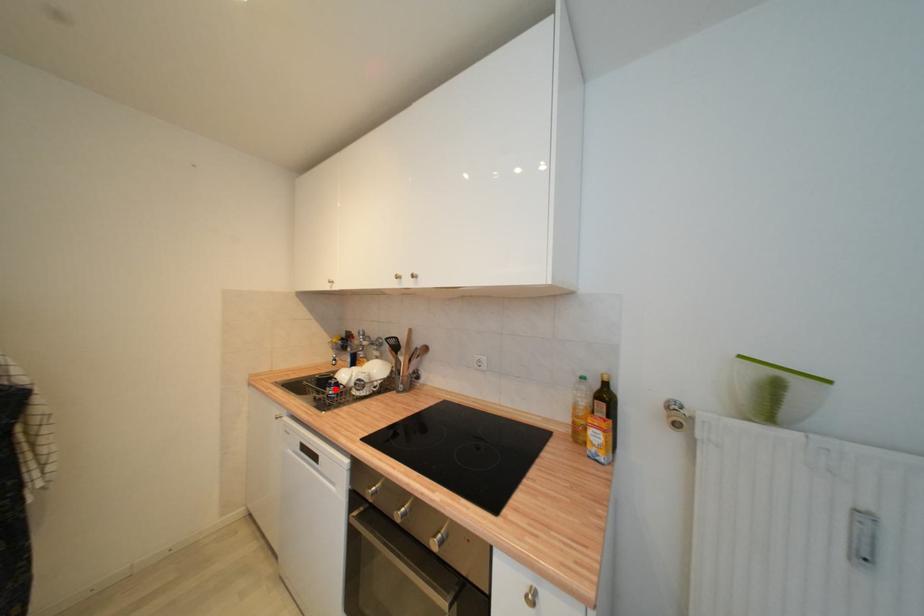
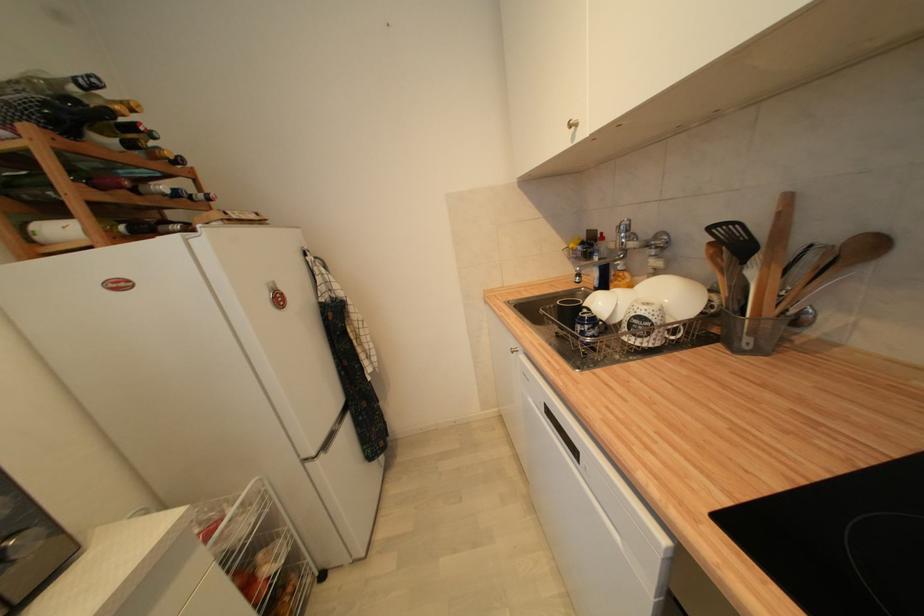
The point at the highlighted location is marked in the first image. Where is the corresponding point in the second image?

(588, 326)